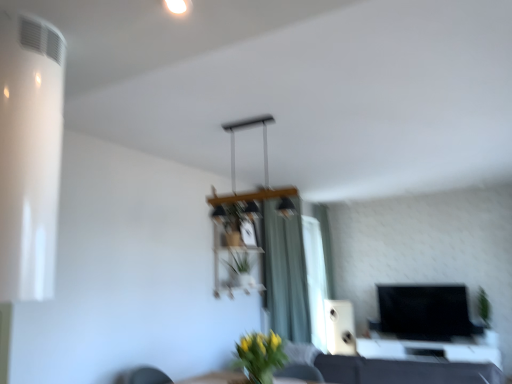
Where is `dark gray fabric couch at lower center`? The height and width of the screenshot is (384, 512). dark gray fabric couch at lower center is located at coordinates (382, 369).

Based on the photo, what is the approximate height of wooden shelf at center?

wooden shelf at center is 1.23 meters in height.

This screenshot has width=512, height=384. What do you see at coordinates (233, 221) in the screenshot?
I see `wooden shelf at center` at bounding box center [233, 221].

Find the location of a particular element. green leafy plant at right, arranged as the first plant when viewed from the right is located at coordinates (483, 307).

What is the approximate width of white plastic air conditioner at left?

The width of white plastic air conditioner at left is 12.05 inches.

Describe the element at coordinates (285, 273) in the screenshot. I see `green fabric curtain at center, placed as the 2th curtain when sorted from right to left` at that location.

Describe the element at coordinates (432, 348) in the screenshot. I see `black glossy table at lower right` at that location.

Find the location of `green matte vase at lower center`. green matte vase at lower center is located at coordinates (259, 378).

Is yellow matte vase at center, acting as the 1th plant starting from the front, at the back of dark gray fabric couch at lower center?

Yes, dark gray fabric couch at lower center is positioned with its back facing yellow matte vase at center, acting as the 1th plant starting from the front.

Could you measure the distance between dark gray fabric couch at lower center and yellow matte vase at center, the 2th plant from the right?

dark gray fabric couch at lower center is 35.41 inches from yellow matte vase at center, the 2th plant from the right.

Can you confirm if dark gray fabric couch at lower center is bigger than yellow matte vase at center, which is counted as the 1th plant, starting from the left?

Yes, dark gray fabric couch at lower center is bigger than yellow matte vase at center, which is counted as the 1th plant, starting from the left.

Is point (315, 379) less distant than point (261, 372)?

No.

Find the location of a particular element. Image resolution: width=512 pixels, height=384 pixels. air conditioning that is above the yellow matte vase at center, positioned as the 2th plant in back-to-front order (from a real-world perspective) is located at coordinates (29, 155).

From a real-world perspective, does yellow matte vase at center, the 2th plant ordered from the bottom, stand above white plastic air conditioner at left?

Actually, yellow matte vase at center, the 2th plant ordered from the bottom, is physically below white plastic air conditioner at left in the real world.

Is yellow matte vase at center, positioned as the 2th plant in back-to-front order, far from white plastic air conditioner at left?

yellow matte vase at center, positioned as the 2th plant in back-to-front order, is positioned a significant distance from white plastic air conditioner at left.

Can you confirm if yellow matte vase at center, the 2th plant ordered from the bottom, is smaller than white plastic air conditioner at left?

Yes.

Which object is more forward, white matte speaker at center or green matte vase at lower center?

green matte vase at lower center is in front.

Is the surface of white matte speaker at center in direct contact with green matte vase at lower center?

No, white matte speaker at center is not making contact with green matte vase at lower center.

Would you say white matte speaker at center contains green matte vase at lower center?

No, white matte speaker at center does not contain green matte vase at lower center.

In the image, is wooden shelf at center on the left side or the right side of black glossy table at lower right?

From the image, it's evident that wooden shelf at center is to the left of black glossy table at lower right.

Is wooden shelf at center in front of black glossy table at lower right?

Yes, wooden shelf at center is in front of black glossy table at lower right.

Is wooden shelf at center taller or shorter than black glossy table at lower right?

Considering their sizes, wooden shelf at center has more height than black glossy table at lower right.

In terms of size, does wooden shelf at center appear bigger or smaller than black glossy table at lower right?

Considering their sizes, wooden shelf at center takes up less space than black glossy table at lower right.

In the scene shown: Is yellow matte vase at center, the 2th plant from the right, turned away from dark gray fabric couch at lower center?

That's not correct — yellow matte vase at center, the 2th plant from the right, is not looking away from dark gray fabric couch at lower center.

How far apart are yellow matte vase at center, acting as the 1th plant starting from the front, and dark gray fabric couch at lower center?

yellow matte vase at center, acting as the 1th plant starting from the front, and dark gray fabric couch at lower center are 89.93 centimeters apart from each other.

Does yellow matte vase at center, which is counted as the 1th plant, starting from the left, appear on the left side of dark gray fabric couch at lower center?

Yes, yellow matte vase at center, which is counted as the 1th plant, starting from the left, is to the left of dark gray fabric couch at lower center.

Would you say yellow matte vase at center, acting as the 1th plant starting from the front, is inside or outside dark gray fabric couch at lower center?

yellow matte vase at center, acting as the 1th plant starting from the front, is located beyond the bounds of dark gray fabric couch at lower center.

Could you tell me if wooden shelf at center is facing dark gray fabric couch at lower center?

No, wooden shelf at center does not turn towards dark gray fabric couch at lower center.

Locate an element on the screen. The height and width of the screenshot is (384, 512). couch that is on the right side of wooden shelf at center is located at coordinates (382, 369).

Is wooden shelf at center in contact with dark gray fabric couch at lower center?

No, wooden shelf at center is not making contact with dark gray fabric couch at lower center.

Is wooden shelf at center taller than dark gray fabric couch at lower center?

Yes, wooden shelf at center is taller than dark gray fabric couch at lower center.

Is dark gray fabric couch at lower center positioned beyond the bounds of green fabric curtain at right, the 1th curtain in the right-to-left sequence?

Absolutely, dark gray fabric couch at lower center is external to green fabric curtain at right, the 1th curtain in the right-to-left sequence.

From the image's perspective, count 1st curtains upward from the dark gray fabric couch at lower center and point to it. Please provide its 2D coordinates.

[(326, 246)]

What's the angular difference between dark gray fabric couch at lower center and green fabric curtain at right, which is the 1th curtain from back to front,'s facing directions?

There is a 90-degree angle between the facing directions of dark gray fabric couch at lower center and green fabric curtain at right, which is the 1th curtain from back to front.

The height and width of the screenshot is (384, 512). I want to click on couch behind the yellow matte vase at center, positioned as the 2th plant in back-to-front order, so click(x=382, y=369).

This screenshot has height=384, width=512. I want to click on air conditioning that is above the yellow matte vase at center, the 2th plant from the right (from a real-world perspective), so click(29, 155).

Estimate the real-world distances between objects in this image. Which object is closer to green leafy plant at right, the first plant viewed from the back, dark gray fabric couch at lower center or yellow matte vase at center, the 2th plant ordered from the bottom?

dark gray fabric couch at lower center lies closer to green leafy plant at right, the first plant viewed from the back, than the other object.

Based on their spatial positions, is white matte speaker at center or yellow matte vase at center, the 2th plant ordered from the bottom, further from green fabric curtain at right, the 1th curtain in the right-to-left sequence?

Based on the image, yellow matte vase at center, the 2th plant ordered from the bottom, appears to be further to green fabric curtain at right, the 1th curtain in the right-to-left sequence.

Looking at the image, which one is located further to green fabric curtain at center, which appears as the second curtain when viewed from the back, black glossy table at lower right or white plastic air conditioner at left?

Based on the image, white plastic air conditioner at left appears to be further to green fabric curtain at center, which appears as the second curtain when viewed from the back.

Which object lies further to the anchor point yellow matte vase at center, which is counted as the 1th plant, starting from the left, white plastic air conditioner at left or green matte vase at lower center?

Among the two, white plastic air conditioner at left is located further to yellow matte vase at center, which is counted as the 1th plant, starting from the left.

From the picture: Based on their spatial positions, is green fabric curtain at right, which is the 1th curtain from back to front, or green leafy plant at right, the 2th plant when ordered from top to bottom, further from dark gray fabric couch at lower center?

Based on the image, green leafy plant at right, the 2th plant when ordered from top to bottom, appears to be further to dark gray fabric couch at lower center.

When comparing their distances from dark gray fabric couch at lower center, does green fabric curtain at right, the second curtain from the left, or wooden shelf at center seem further?

Based on the image, green fabric curtain at right, the second curtain from the left, appears to be further to dark gray fabric couch at lower center.

Estimate the real-world distances between objects in this image. Which object is further from green matte vase at lower center, green fabric curtain at right, the second curtain from the left, or wooden shelf at center?

green fabric curtain at right, the second curtain from the left, is positioned further to the anchor green matte vase at lower center.

Looking at the image, which one is located closer to white plastic air conditioner at left, dark gray fabric couch at lower center or green fabric curtain at right, the 2th curtain in the front-to-back sequence?

dark gray fabric couch at lower center is closer to white plastic air conditioner at left.

Locate an element on the screen. The width and height of the screenshot is (512, 384). vase between white plastic air conditioner at left and dark gray fabric couch at lower center from front to back is located at coordinates (259, 378).

Where is `plant between green matte vase at lower center and green fabric curtain at right, the 2th curtain in the front-to-back sequence, along the z-axis`? Image resolution: width=512 pixels, height=384 pixels. plant between green matte vase at lower center and green fabric curtain at right, the 2th curtain in the front-to-back sequence, along the z-axis is located at coordinates (483, 307).

The image size is (512, 384). I want to click on curtain located between white plastic air conditioner at left and black glossy table at lower right in the depth direction, so click(x=285, y=273).

I want to click on curtain located between green matte vase at lower center and white matte speaker at center in the depth direction, so click(x=285, y=273).